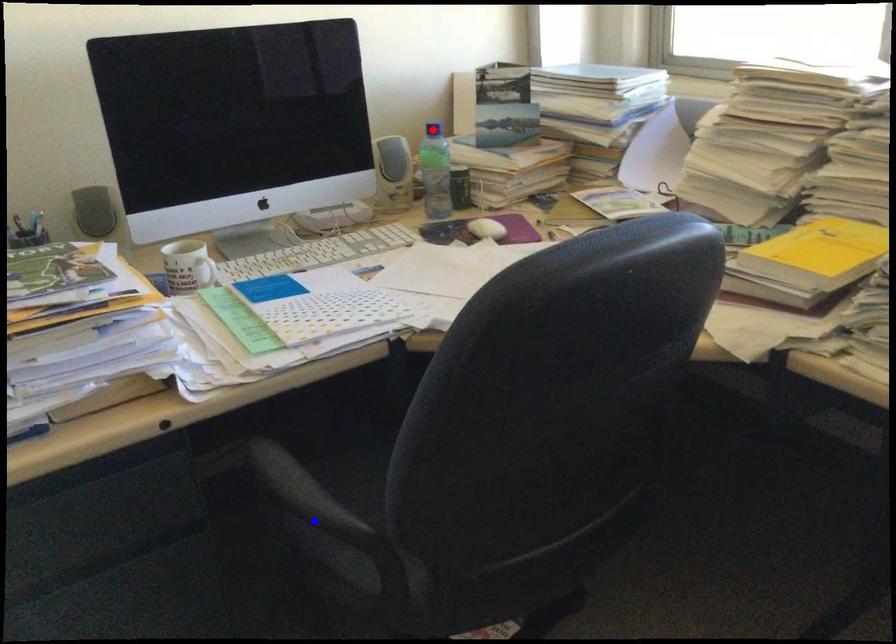
Question: In the image, two points are highlighted. Which point is nearer to the camera? Reply with the corresponding letter.

Choices:
 (A) blue point
 (B) red point

Answer: (A)